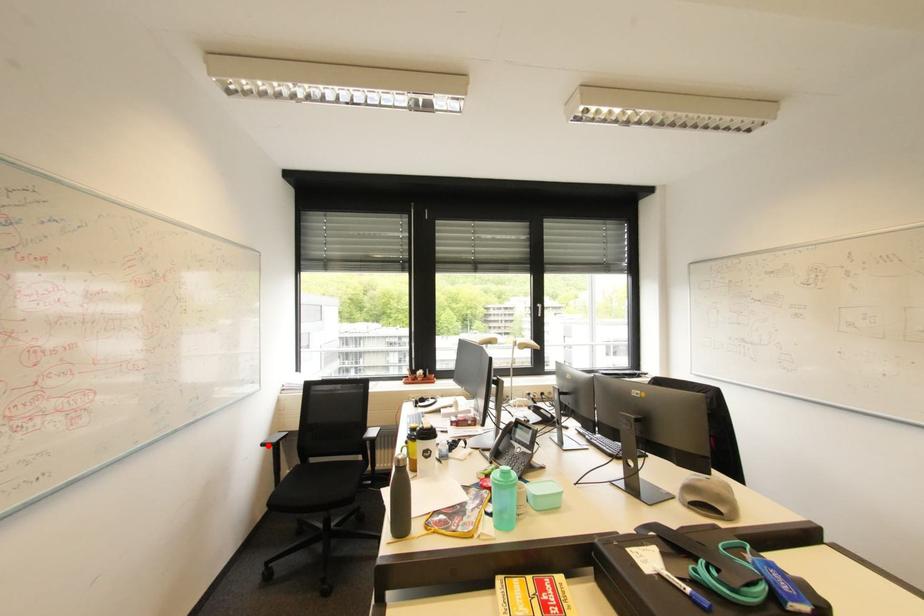
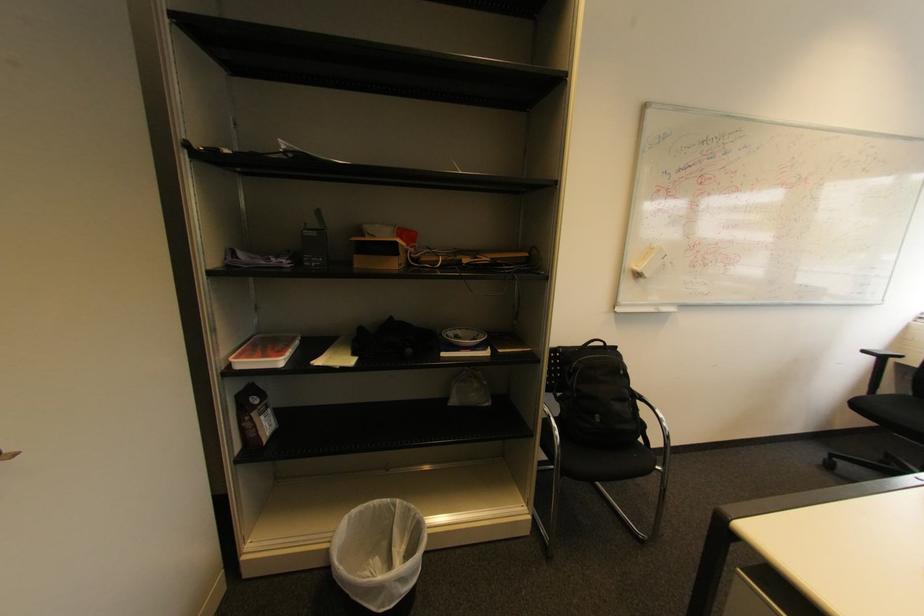
Question: A red point is marked in image1. In image2, is the corresponding 3D point closer to the camera or farther? Reply with the corresponding letter.

Choices:
 (A) The corresponding 3D point is closer.
 (B) The corresponding 3D point is farther.

Answer: (B)